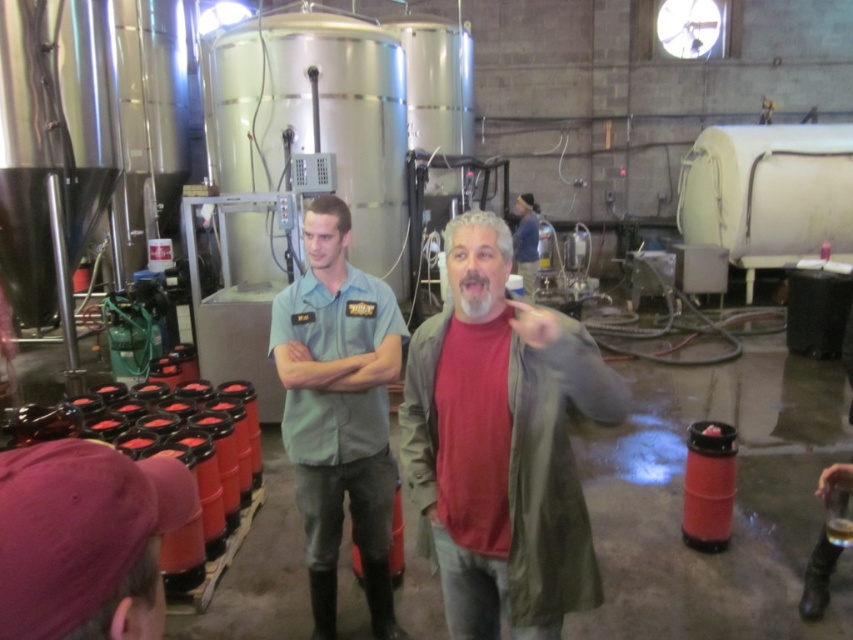
Who is more forward, [439,381] or [519,228]?

Positioned in front is point [439,381].

Based on the photo, who is higher up, red matte jacket at center or blue denim jacket at center?

Positioned higher is blue denim jacket at center.

Which is behind, point (502, 435) or point (532, 282)?

The point (532, 282) is behind.

Find the location of a particular element. red matte jacket at center is located at coordinates (502, 444).

Between matte blue shirt at center and blue denim jacket at center, which one appears on the left side from the viewer's perspective?

matte blue shirt at center

Which is behind, point (386, 456) or point (531, 202)?

The point (531, 202) is behind.

Where is `matte blue shirt at center`? The height and width of the screenshot is (640, 853). matte blue shirt at center is located at coordinates (339, 410).

Is red matte jacket at center wider than matte blue shirt at center?

Indeed, red matte jacket at center has a greater width compared to matte blue shirt at center.

Which is more to the right, red matte jacket at center or matte blue shirt at center?

red matte jacket at center is more to the right.

The image size is (853, 640). Describe the element at coordinates (502, 444) in the screenshot. I see `red matte jacket at center` at that location.

At what (x,y) coordinates should I click in order to perform the action: click on red matte jacket at center. Please return your answer as a coordinate pair (x, y). Image resolution: width=853 pixels, height=640 pixels. Looking at the image, I should click on (502, 444).